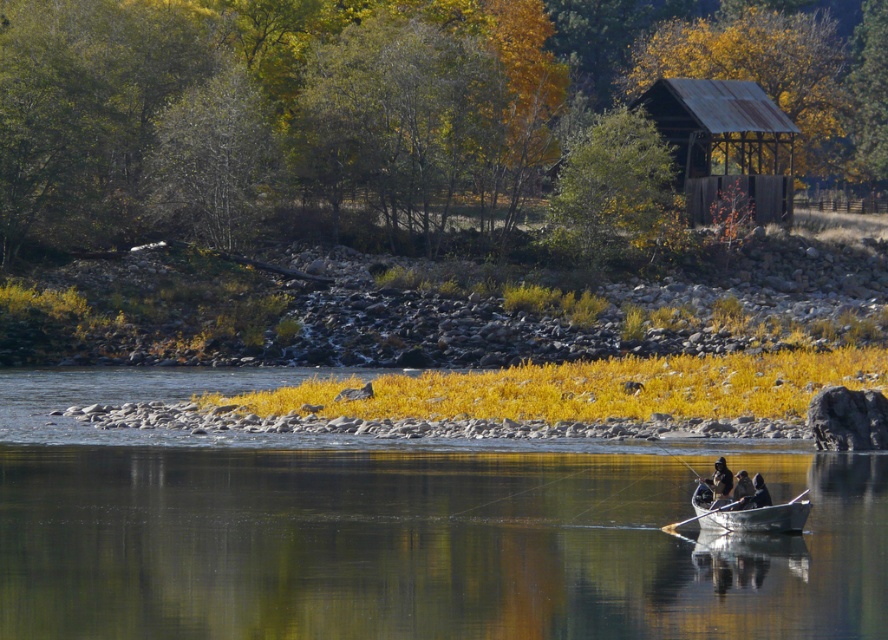
Question: Can you confirm if clear water at center is bigger than dark brown leather jacket at lower right?

Choices:
 (A) yes
 (B) no

Answer: (A)

Question: Which point is closer to the camera?

Choices:
 (A) clear water at center
 (B) dark brown leather jacket at lower right
 (C) rusty metal hut at upper right

Answer: (A)

Question: Which point is closer to the camera taking this photo?

Choices:
 (A) (786, 202)
 (B) (599, 465)
 (C) (740, 518)

Answer: (C)

Question: Which point is farther to the camera?

Choices:
 (A) (768, 168)
 (B) (809, 508)
 (C) (448, 480)

Answer: (A)

Question: Does clear water at center appear under dark brown leather jacket at lower right?

Choices:
 (A) no
 (B) yes

Answer: (B)

Question: Is clear water at center bigger than rusty metal hut at upper right?

Choices:
 (A) yes
 (B) no

Answer: (B)